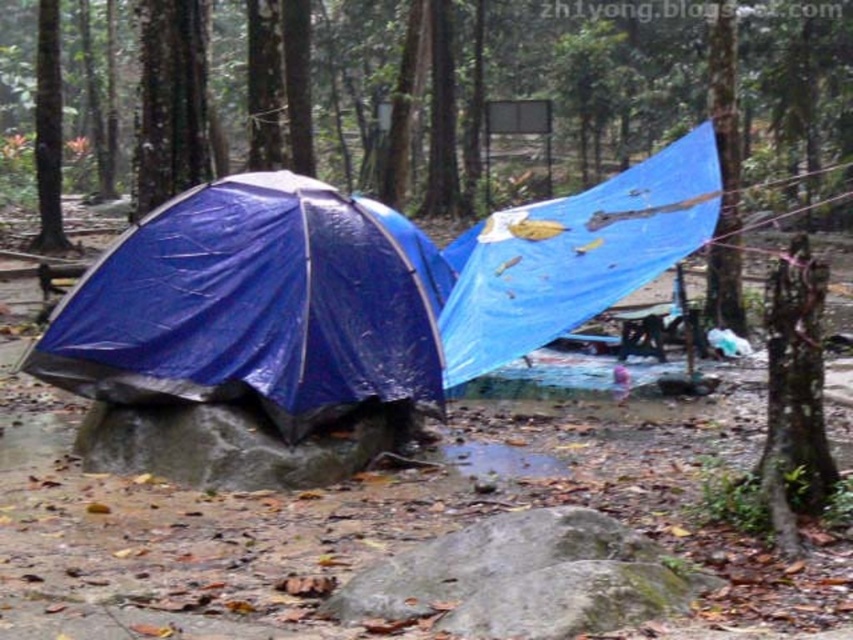
Question: Which point appears closest to the camera in this image?

Choices:
 (A) (387, 221)
 (B) (494, 220)

Answer: (B)

Question: Is blue tarpaulin tent at left thinner than blue tarpaulin tent at center?

Choices:
 (A) no
 (B) yes

Answer: (A)

Question: Can you confirm if blue tarpaulin tent at left is smaller than blue tarpaulin tent at center?

Choices:
 (A) yes
 (B) no

Answer: (A)

Question: Which object appears closest to the camera in this image?

Choices:
 (A) blue tarpaulin tent at left
 (B) blue tarpaulin tent at center

Answer: (A)

Question: Is blue tarpaulin tent at left above blue tarpaulin tent at center?

Choices:
 (A) yes
 (B) no

Answer: (B)